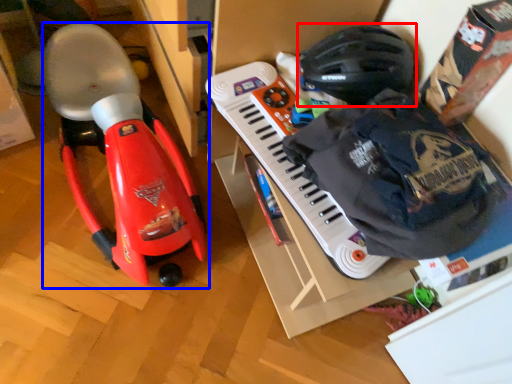
Question: Which point is further to the camera, helmet (highlighted by a red box) or toy (highlighted by a blue box)?

Choices:
 (A) helmet
 (B) toy

Answer: (A)